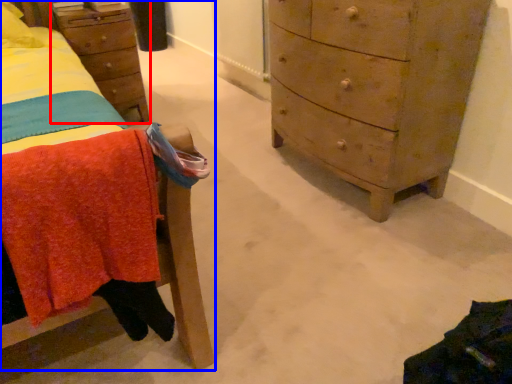
Question: Which of the following is the closest to the observer, nightstand (highlighted by a red box) or furniture (highlighted by a blue box)?

Choices:
 (A) nightstand
 (B) furniture

Answer: (B)